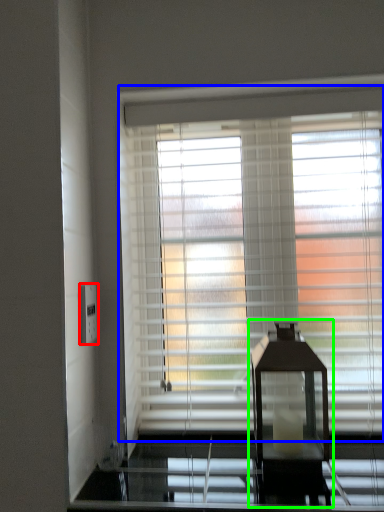
Question: Estimate the real-world distances between objects in this image. Which object is closer to electric outlet (highlighted by a red box), window blind (highlighted by a blue box) or table lamp (highlighted by a green box)?

Choices:
 (A) window blind
 (B) table lamp

Answer: (A)